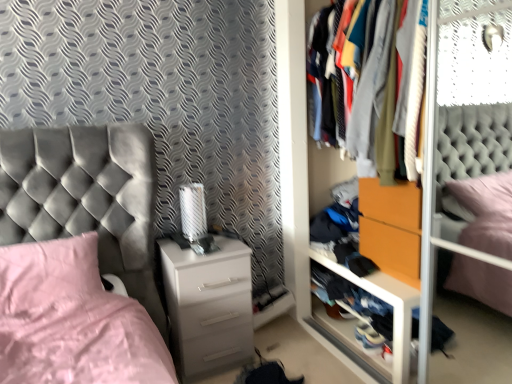
Question: Does point (365, 276) appear closer or farther from the camera than point (398, 283)?

Choices:
 (A) closer
 (B) farther

Answer: (B)

Question: Is wooden shelf at lower right bigger or smaller than wooden drawer at right?

Choices:
 (A) big
 (B) small

Answer: (B)

Question: Which of these objects is positioned closest to the white glossy chest of drawers at center?

Choices:
 (A) pink fabric pillow at lower left
 (B) wooden shelf at lower right
 (C) wooden drawer at right
 (D) textured fabric clothes at center
 (E) orange matte drawer at center

Answer: (A)

Question: Estimate the real-world distances between objects in this image. Which object is closer to the pink fabric pillow at lower left?

Choices:
 (A) wooden drawer at right
 (B) wooden shelf at lower right
 (C) textured fabric clothes at center
 (D) white glossy chest of drawers at center
 (E) orange matte drawer at center

Answer: (D)